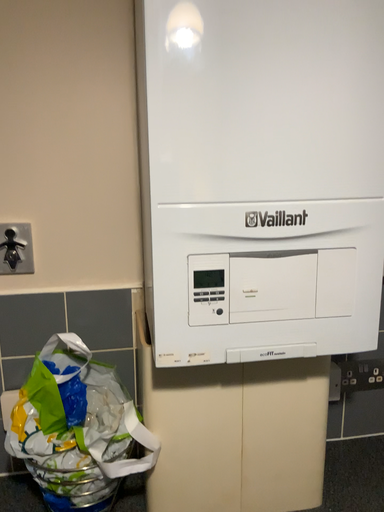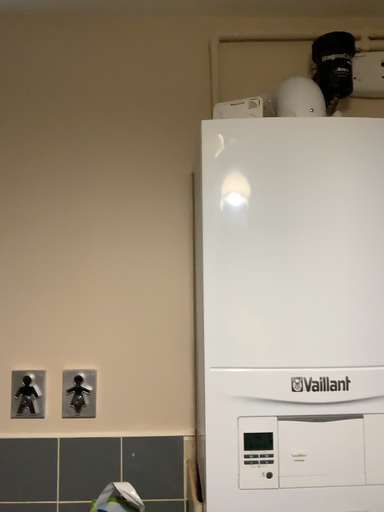
Question: Which way did the camera rotate in the video?

Choices:
 (A) rotated downward
 (B) rotated upward

Answer: (B)